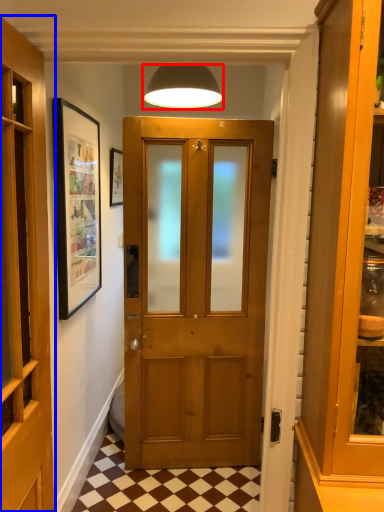
Question: Which point is further to the camera, lamp (highlighted by a red box) or door (highlighted by a blue box)?

Choices:
 (A) lamp
 (B) door

Answer: (A)